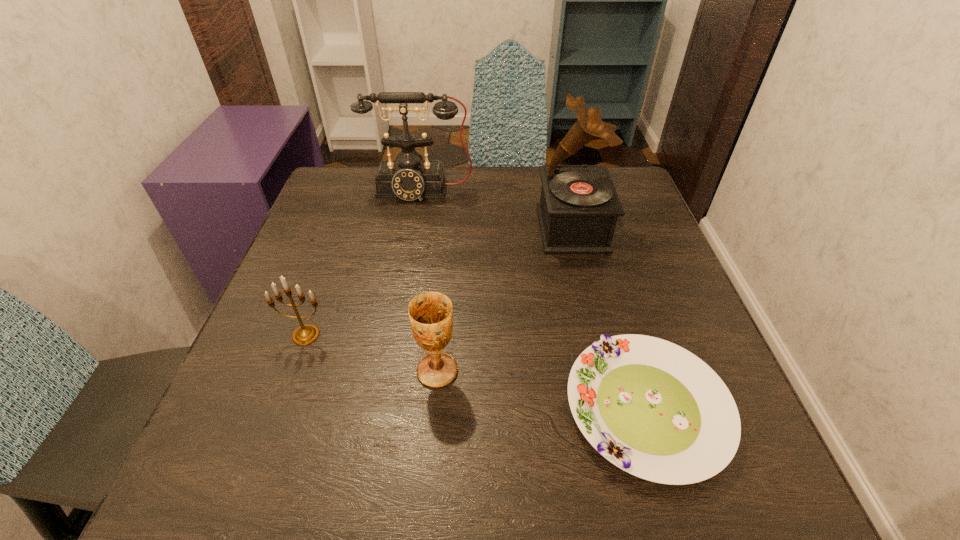
The height and width of the screenshot is (540, 960). I want to click on vacant area between the telephone and the chalice, so click(x=428, y=280).

Find the location of `free space between the phonograph_record and the salad plate`. free space between the phonograph_record and the salad plate is located at coordinates (610, 319).

The image size is (960, 540). Identify the location of empty space that is in between the chalice and the candelabrum. (372, 353).

This screenshot has height=540, width=960. In order to click on free space between the chalice and the tallest object in this screenshot , I will do pyautogui.click(x=505, y=300).

You are a GUI agent. You are given a task and a screenshot of the screen. Output one action in this format:
    pyautogui.click(x=<x>, y=<y>)
    Task: Click on the free spot between the second tallest object and the chalice
    
    Given the screenshot: What is the action you would take?
    pyautogui.click(x=428, y=280)

Identify the location of unoccupied area between the second tallest object and the phonograph_record. (495, 209).

This screenshot has width=960, height=540. Identify the location of free space between the chalice and the candelabrum. (372, 353).

This screenshot has height=540, width=960. I want to click on empty location between the chalice and the salad plate, so click(542, 390).

Identify the location of unoccupied position between the fourth nearest object and the chalice. The height and width of the screenshot is (540, 960). (505, 300).

Locate an element on the screen. The width and height of the screenshot is (960, 540). the second closest object to the salad plate is located at coordinates (579, 206).